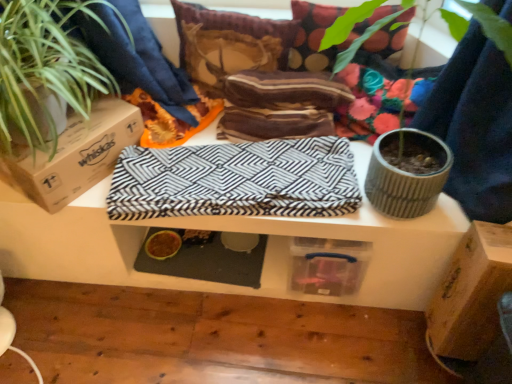
Question: Is brown cardboard box at left, the 2th cardboard box from the right, looking in the opposite direction of brown cardboard box at lower right, which appears as the 1th cardboard box when ordered from the bottom?

Choices:
 (A) yes
 (B) no

Answer: (B)

Question: Is brown cardboard box at left, the second cardboard box ordered from the bottom, behind brown cardboard box at lower right, which is the first cardboard box from right to left?

Choices:
 (A) no
 (B) yes

Answer: (B)

Question: Is brown cardboard box at left, the second cardboard box ordered from the bottom, positioned beyond the bounds of brown cardboard box at lower right, which is the first cardboard box from right to left?

Choices:
 (A) yes
 (B) no

Answer: (A)

Question: Is brown cardboard box at left, the second cardboard box ordered from the bottom, thinner than brown cardboard box at lower right, which is the first cardboard box from right to left?

Choices:
 (A) yes
 (B) no

Answer: (A)

Question: Is brown cardboard box at left, marked as the 1th cardboard box in a top-to-bottom arrangement, shorter than brown cardboard box at lower right, acting as the second cardboard box starting from the top?

Choices:
 (A) no
 (B) yes

Answer: (B)

Question: From a real-world perspective, does brown cardboard box at left, which is the first cardboard box from left to right, sit lower than brown cardboard box at lower right, which is counted as the 2th cardboard box, starting from the left?

Choices:
 (A) yes
 (B) no

Answer: (B)

Question: Is brown cardboard box at lower right, which is the first cardboard box from right to left, outside of green leafy plant at left?

Choices:
 (A) yes
 (B) no

Answer: (A)

Question: Is brown cardboard box at lower right, acting as the second cardboard box starting from the top, not near green leafy plant at left?

Choices:
 (A) no
 (B) yes

Answer: (B)

Question: Does brown cardboard box at lower right, which is counted as the 2th cardboard box, starting from the left, come in front of green leafy plant at left?

Choices:
 (A) no
 (B) yes

Answer: (A)

Question: From a real-world perspective, is brown cardboard box at lower right, which is the first cardboard box from right to left, positioned over green leafy plant at left based on gravity?

Choices:
 (A) yes
 (B) no

Answer: (B)

Question: Is brown cardboard box at lower right, which is the first cardboard box from right to left, further to camera compared to green leafy plant at left?

Choices:
 (A) no
 (B) yes

Answer: (B)

Question: From the image's perspective, does brown cardboard box at lower right, which is counted as the 2th cardboard box, starting from the left, appear higher than green leafy plant at left?

Choices:
 (A) yes
 (B) no

Answer: (B)

Question: Does green textured plant at upper right have a lesser width compared to brown cardboard box at left, the second cardboard box ordered from the bottom?

Choices:
 (A) yes
 (B) no

Answer: (B)